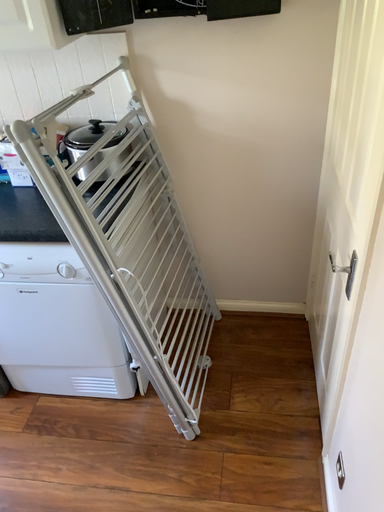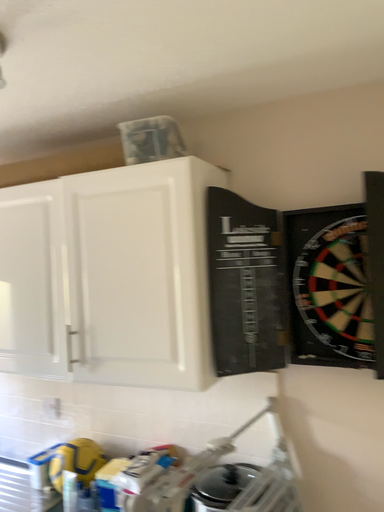
Question: How did the camera likely rotate when shooting the video?

Choices:
 (A) rotated downward
 (B) rotated upward

Answer: (B)